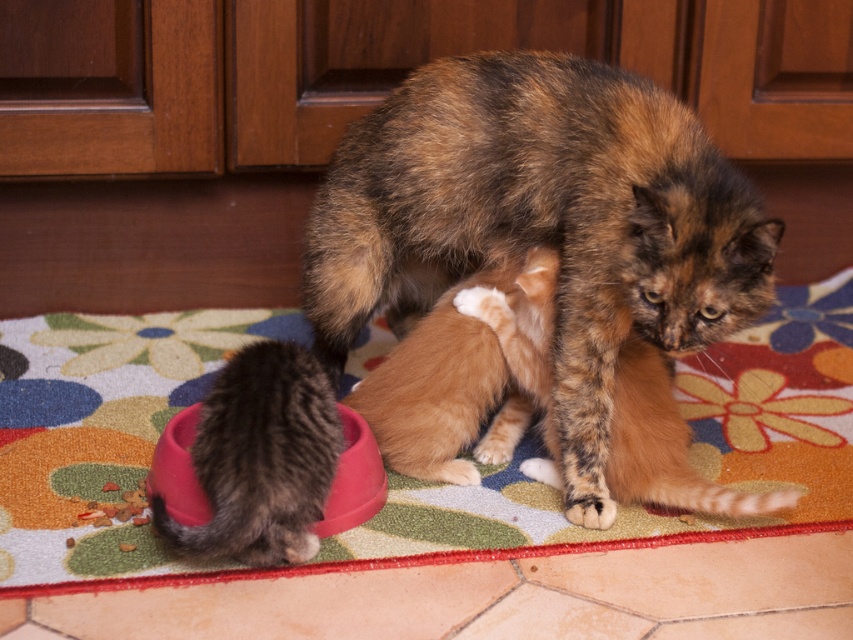
Question: Does floral carpet at center have a smaller size compared to soft fur paw at lower center?

Choices:
 (A) no
 (B) yes

Answer: (A)

Question: Which point appears closest to the camera in this image?

Choices:
 (A) (120, 525)
 (B) (410, 300)
 (C) (596, 512)

Answer: (A)

Question: Can you confirm if fluffy tortoiseshell cat at center is smaller than soft fur paw at lower center?

Choices:
 (A) no
 (B) yes

Answer: (A)

Question: Estimate the real-world distances between objects in this image. Which object is farther from the soft fur paw at lower center?

Choices:
 (A) fluffy tortoiseshell cat at center
 (B) floral carpet at center

Answer: (B)

Question: Which of these objects is positioned farthest from the floral carpet at center?

Choices:
 (A) soft fur paw at lower center
 (B) fluffy tortoiseshell cat at center

Answer: (A)

Question: Does fluffy tortoiseshell cat at center have a greater width compared to floral carpet at center?

Choices:
 (A) no
 (B) yes

Answer: (A)